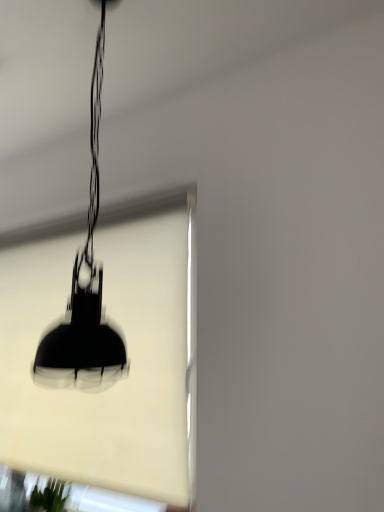
I want to click on black matte lampshade at center, so click(102, 358).

What do you see at coordinates (102, 358) in the screenshot? This screenshot has width=384, height=512. I see `black matte lampshade at center` at bounding box center [102, 358].

I want to click on black matte lamp at center, so click(85, 290).

The height and width of the screenshot is (512, 384). What do you see at coordinates (85, 290) in the screenshot?
I see `black matte lamp at center` at bounding box center [85, 290].

Measure the distance between point (91, 277) and camera.

35.20 inches.

Where is `black matte lampshade at center`? black matte lampshade at center is located at coordinates (102, 358).

Between black matte lamp at center and black matte lampshade at center, which one appears on the left side from the viewer's perspective?

black matte lampshade at center.

Between black matte lamp at center and black matte lampshade at center, which one is positioned behind?

black matte lampshade at center.

Is point (94, 146) in front of point (17, 372)?

Yes.

From the image's perspective, relative to black matte lampshade at center, is black matte lamp at center above or below?

black matte lamp at center is above black matte lampshade at center.

From a real-world perspective, is black matte lamp at center positioned under black matte lampshade at center based on gravity?

No, from a real-world perspective, black matte lamp at center is not under black matte lampshade at center.

From the picture: Between black matte lamp at center and black matte lampshade at center, which one has larger width?

black matte lamp at center.

From their relative heights in the image, would you say black matte lamp at center is taller or shorter than black matte lampshade at center?

black matte lamp at center is shorter than black matte lampshade at center.

Does black matte lamp at center have a larger size compared to black matte lampshade at center?

Incorrect, black matte lamp at center is not larger than black matte lampshade at center.

Is black matte lamp at center not within black matte lampshade at center?

Absolutely, black matte lamp at center is external to black matte lampshade at center.

Consider the image. Is there a large distance between black matte lamp at center and black matte lampshade at center?

That's not correct — black matte lamp at center is a little close to black matte lampshade at center.

Is black matte lamp at center oriented away from black matte lampshade at center?

That's not correct — black matte lamp at center is not looking away from black matte lampshade at center.

How many degrees apart are the facing directions of black matte lamp at center and black matte lampshade at center?

They differ by 0.714 degrees in their facing directions.

Measure the distance between black matte lamp at center and black matte lampshade at center.

They are 31.67 centimeters apart.

The height and width of the screenshot is (512, 384). I want to click on window screen that is below the black matte lamp at center (from the image's perspective), so click(x=102, y=358).

Visually, is black matte lampshade at center positioned to the left or to the right of black matte lamp at center?

In the image, black matte lampshade at center appears on the left side of black matte lamp at center.

Does black matte lampshade at center come in front of black matte lamp at center?

No, the depth of black matte lampshade at center is greater than that of black matte lamp at center.

Is point (136, 297) closer or farther from the camera than point (59, 368)?

Point (136, 297) is positioned farther from the camera compared to point (59, 368).

From the image's perspective, which one is positioned lower, black matte lampshade at center or black matte lamp at center?

black matte lampshade at center is shown below in the image.

Consider the image. From a real-world perspective, which object stands above the other?

In real-world perspective, black matte lamp at center is above.

Considering the sizes of objects black matte lampshade at center and black matte lamp at center in the image provided, who is thinner, black matte lampshade at center or black matte lamp at center?

black matte lampshade at center.

Which of these two, black matte lampshade at center or black matte lamp at center, stands taller?

With more height is black matte lampshade at center.

Considering the relative sizes of black matte lampshade at center and black matte lamp at center in the image provided, is black matte lampshade at center smaller than black matte lamp at center?

No.

Can black matte lamp at center be found inside black matte lampshade at center?

No, black matte lamp at center is not inside black matte lampshade at center.

Are black matte lampshade at center and black matte lamp at center beside each other?

No, black matte lampshade at center is not making contact with black matte lamp at center.

Is black matte lampshade at center aimed at black matte lamp at center?

Yes, black matte lampshade at center is facing black matte lamp at center.

What's the angular difference between black matte lampshade at center and black matte lamp at center's facing directions?

The angular difference between black matte lampshade at center and black matte lamp at center is 0.714 degrees.

How far apart are black matte lampshade at center and black matte lamp at center?

12.47 inches.

Where is `lamp in front of the black matte lampshade at center`? This screenshot has height=512, width=384. lamp in front of the black matte lampshade at center is located at coordinates (85, 290).

I want to click on window screen below the black matte lamp at center (from a real-world perspective), so click(102, 358).

Identify the location of lamp on the right of black matte lampshade at center. (85, 290).